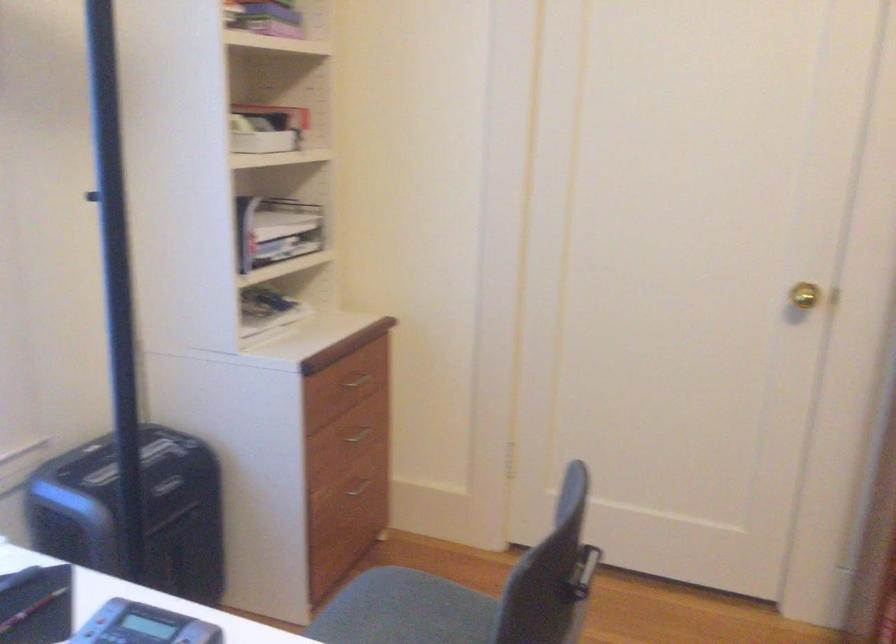
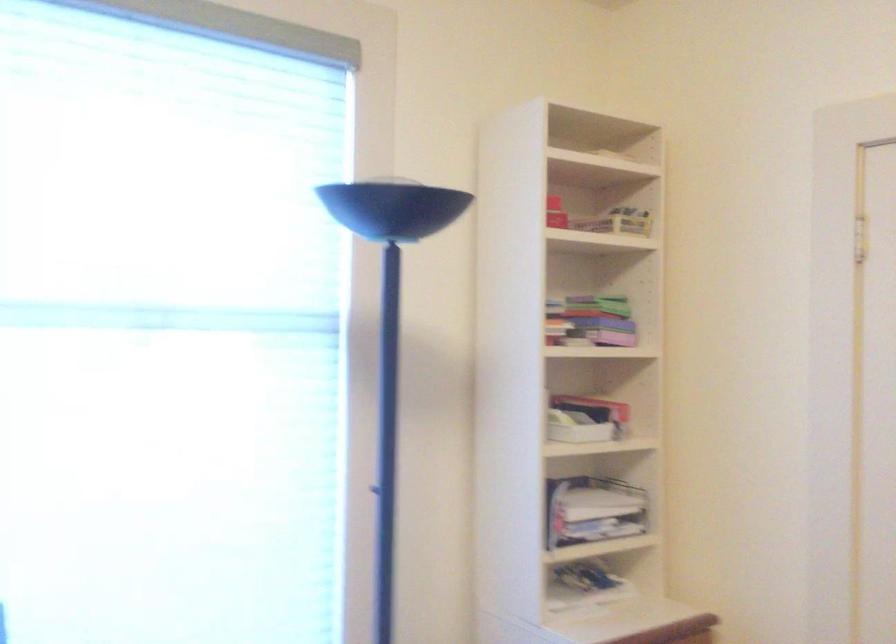
The point at (254,134) is marked in the first image. Where is the corresponding point in the second image?

(576, 428)